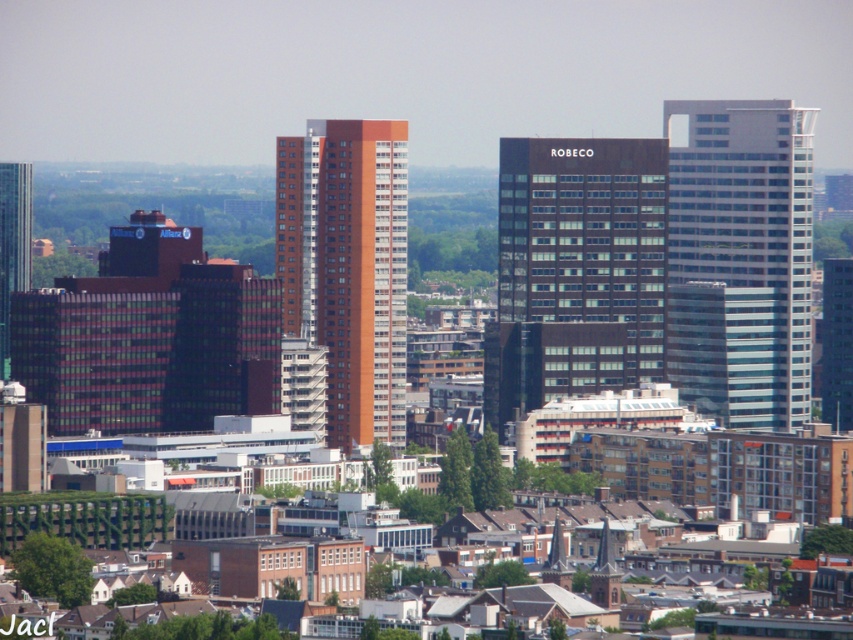
Question: Is dark glass building at center below brown matte building at center?

Choices:
 (A) yes
 (B) no

Answer: (A)

Question: Is the position of glassy blue skyscraper at right more distant than that of brown matte building at center?

Choices:
 (A) no
 (B) yes

Answer: (B)

Question: Which object is positioned farthest from the glassy blue skyscraper at right?

Choices:
 (A) green glass skyscraper at left
 (B) brown matte building at center

Answer: (A)

Question: Which object is closer to the camera taking this photo?

Choices:
 (A) brown matte building at center
 (B) green glass skyscraper at left
 (C) glassy blue skyscraper at right
 (D) dark glass building at center

Answer: (A)

Question: Does glassy blue skyscraper at right appear over green glass skyscraper at left?

Choices:
 (A) yes
 (B) no

Answer: (A)

Question: Which of the following is the farthest from the observer?

Choices:
 (A) brown matte building at center
 (B) glassy blue skyscraper at right
 (C) dark glass building at center

Answer: (B)